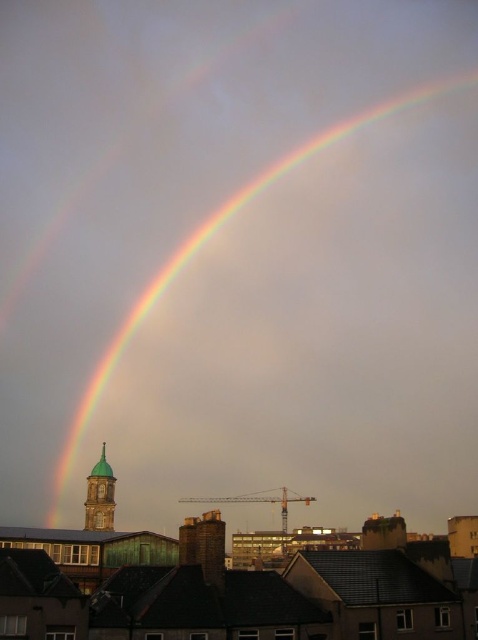
You are an astronomer analyzing the image. The rainbow at upper center is represented by point (209, 237). What is the coordinate of the rainbow at upper center?

The rainbow at upper center is represented by point (209, 237).